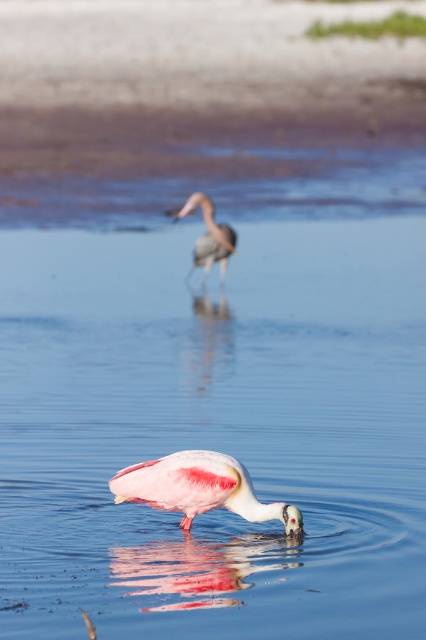
Does pink matte spoonbill at center have a lesser width compared to pink matte bird at center?

No, pink matte spoonbill at center is not thinner than pink matte bird at center.

Is pink matte spoonbill at center below pink matte bird at center?

Indeed, pink matte spoonbill at center is positioned under pink matte bird at center.

Identify the location of pink matte spoonbill at center. (198, 486).